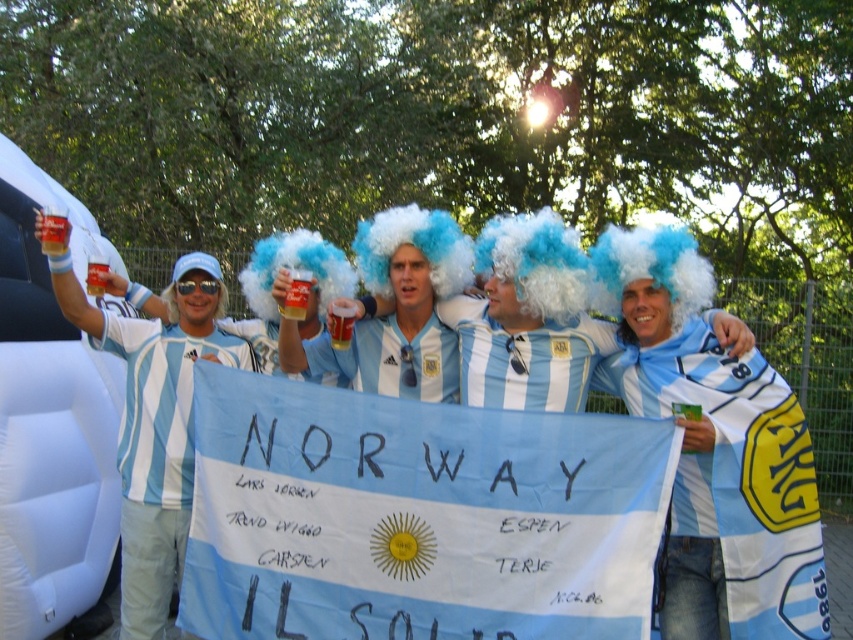
Is light blue striped jersey at center closer to camera compared to matte plastic cup at center?

Yes, it is in front of matte plastic cup at center.

Can you confirm if light blue striped jersey at center is smaller than matte plastic cup at center?

No.

The width and height of the screenshot is (853, 640). I want to click on light blue striped jersey at center, so click(289, 266).

Between light blue striped jersey at center and white fluffy wig at upper left, which one appears on the right side from the viewer's perspective?

light blue striped jersey at center

Between point (558, 394) and point (172, 300), which one is positioned behind?

The point (172, 300) is behind.

Does point (125, 561) come behind point (227, 292)?

No, (125, 561) is closer to viewer.

Image resolution: width=853 pixels, height=640 pixels. In order to click on light blue striped jersey at center in this screenshot , I will do `click(289, 266)`.

Can you confirm if matte plastic cup at center is bigger than translucent plastic cup at upper left?

Yes, matte plastic cup at center is bigger than translucent plastic cup at upper left.

Is matte plastic cup at center below translucent plastic cup at upper left?

Correct, matte plastic cup at center is located below translucent plastic cup at upper left.

Measure the distance between matte plastic cup at center and camera.

matte plastic cup at center and camera are 3.96 meters apart from each other.

The width and height of the screenshot is (853, 640). What are the coordinates of `matte plastic cup at center` in the screenshot? It's located at tap(396, 308).